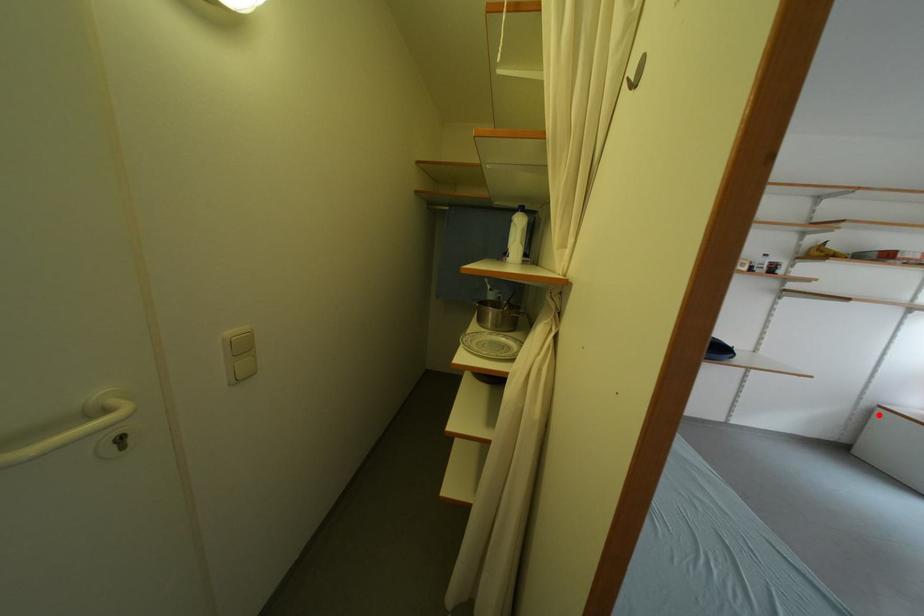
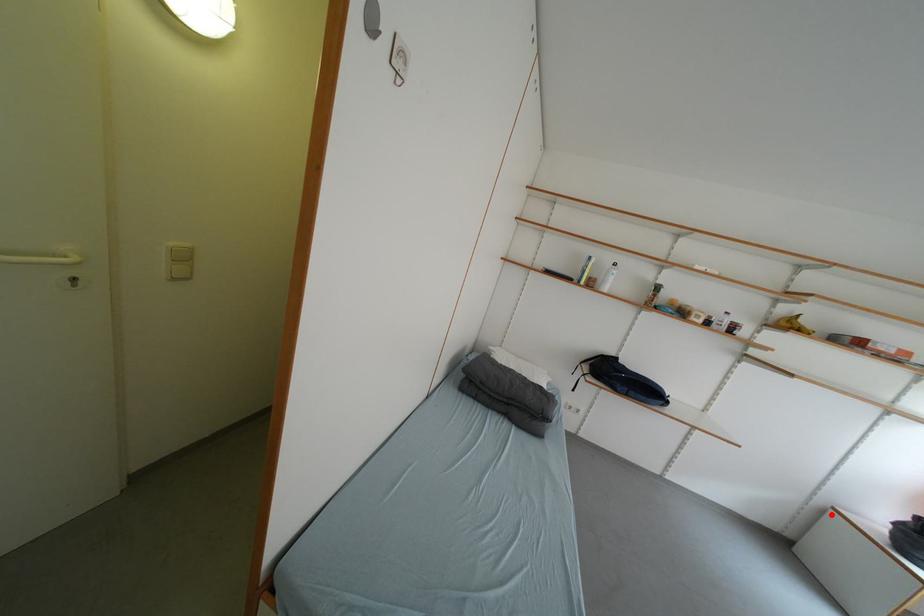
I am providing you with two images of the same scene from different viewpoints. A red point is marked on the first image and another point is marked on the second image. Does the point marked in image1 correspond to the same location as the one in image2?

Yes